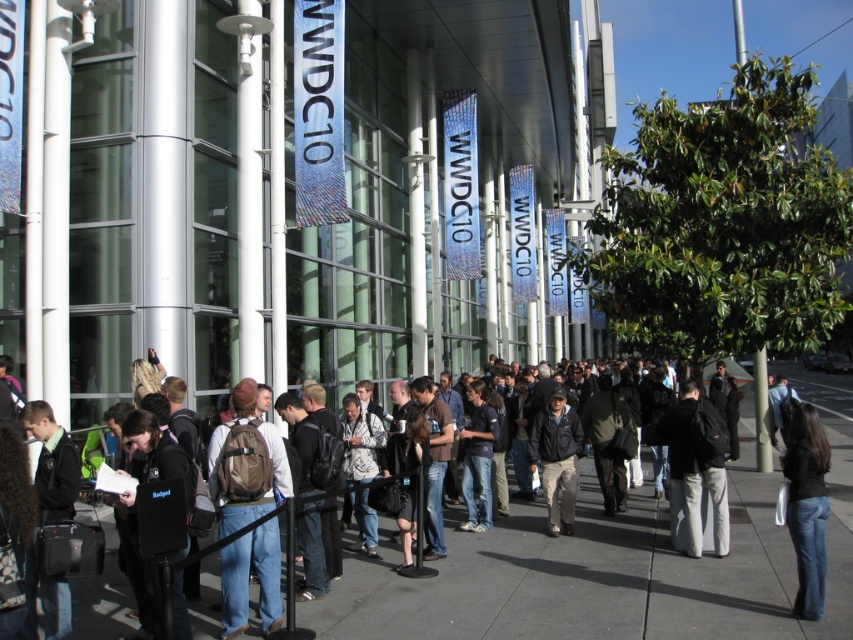
From the picture: You are standing at the point marked as point (808, 540) in the image. There is another point 20.09 feet away from you. If you want to walk to that point, would you need to cross the busy sidewalk where the line of people is? Please explain your reasoning.

The point 20.09 feet away from point (808, 540) is located across the busy sidewalk where the line of people is. Since the distance is significant and the sidewalk is occupied by a long line, you would likely need to navigate through the crowd to reach the destination.

You are standing at the entrance of the WWDC 10 building and notice two items in the scene. One is the denim jeans at lower right and the other is the dark gray backpack at center. Which item is positioned lower in the image?

The denim jeans at lower right is located below the dark gray backpack at center, so the denim jeans at lower right is positioned lower in the image.